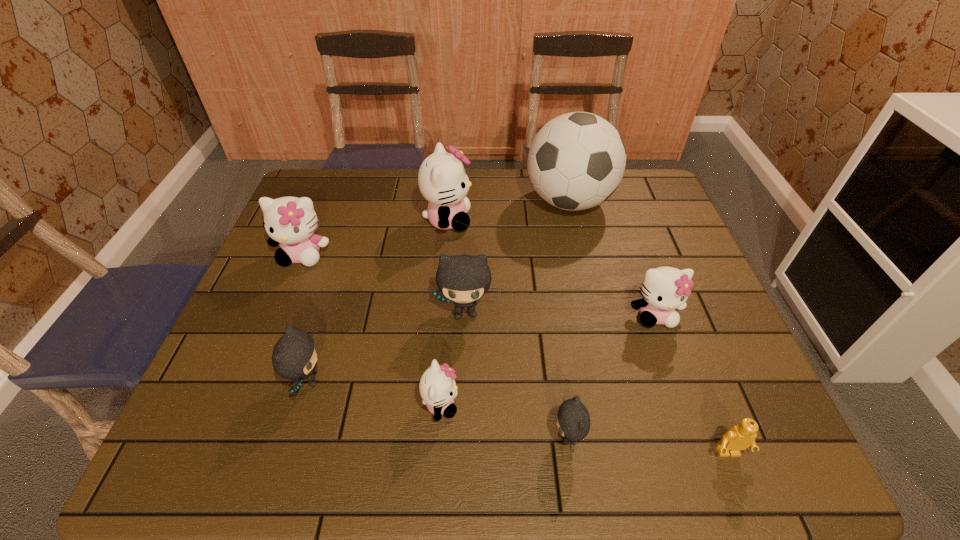
I want to click on soccer ball, so click(576, 161).

What are the coordinates of `the tallest object` in the screenshot? It's located at (576, 161).

The height and width of the screenshot is (540, 960). Find the location of `the biggest white kitten`. the biggest white kitten is located at coordinates (442, 179).

In order to click on the tallest kitten in this screenshot , I will do `click(442, 179)`.

Identify the location of the third smallest white kitten. (290, 222).

The height and width of the screenshot is (540, 960). Find the location of `the biggest gray kitten`. the biggest gray kitten is located at coordinates (462, 279).

At what (x,y) coordinates should I click in order to perform the action: click on the second gray kitten from right to left. Please return your answer as a coordinate pair (x, y). This screenshot has height=540, width=960. Looking at the image, I should click on (462, 279).

Locate an element on the screen. the third biggest white kitten is located at coordinates (664, 289).

This screenshot has width=960, height=540. What are the coordinates of `the rightmost kitten` in the screenshot? It's located at (664, 289).

This screenshot has width=960, height=540. Identify the location of the leftmost gray kitten. coord(294,356).